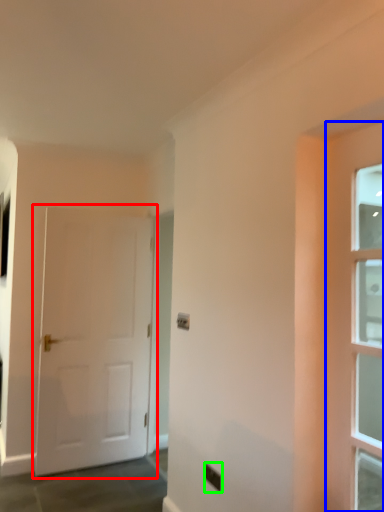
Question: Which is nearer to the door (highlighted by a red box)? door (highlighted by a blue box) or electric outlet (highlighted by a green box).

Choices:
 (A) door
 (B) electric outlet

Answer: (B)